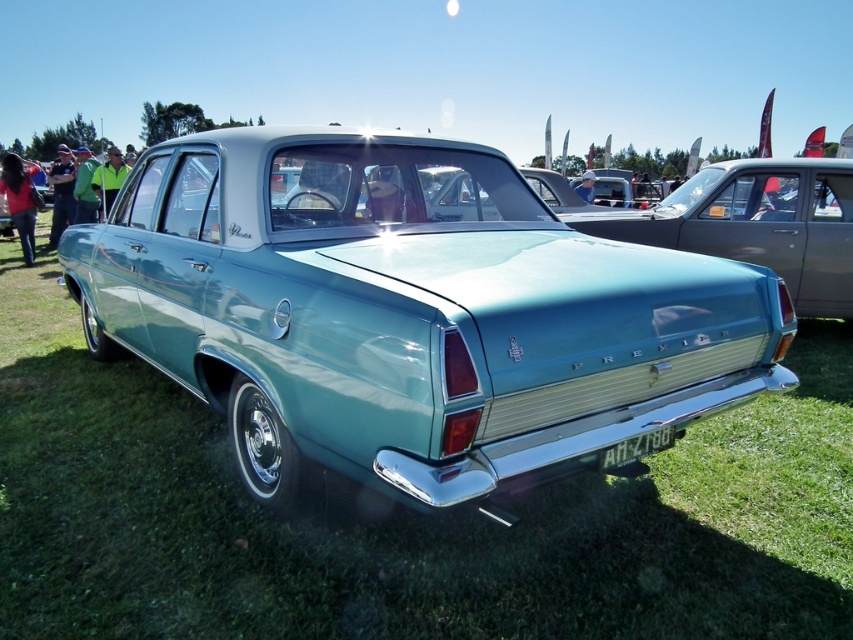
Question: Which object is closer to the camera taking this photo?

Choices:
 (A) white plastic license plate at center
 (B) teal glossy sedan at center

Answer: (B)

Question: Which of the following is the closest to the observer?

Choices:
 (A) (636, 458)
 (B) (120, 260)

Answer: (A)

Question: Considering the relative positions of teal glossy sedan at center and white plastic license plate at center in the image provided, where is teal glossy sedan at center located with respect to white plastic license plate at center?

Choices:
 (A) above
 (B) below

Answer: (A)

Question: Is teal glossy sedan at center wider than white plastic license plate at center?

Choices:
 (A) no
 (B) yes

Answer: (B)

Question: Is teal glossy sedan at center further to the viewer compared to white plastic license plate at center?

Choices:
 (A) no
 (B) yes

Answer: (A)